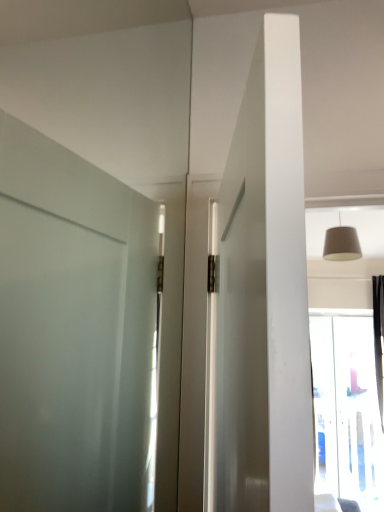
Question: Are transparent glass window at upper right and matte beige lampshade at upper right making contact?

Choices:
 (A) yes
 (B) no

Answer: (B)

Question: From a real-world perspective, is transparent glass window at upper right beneath matte beige lampshade at upper right?

Choices:
 (A) no
 (B) yes

Answer: (B)

Question: Considering the relative positions of transparent glass window at upper right and matte beige lampshade at upper right in the image provided, is transparent glass window at upper right to the right of matte beige lampshade at upper right from the viewer's perspective?

Choices:
 (A) yes
 (B) no

Answer: (A)

Question: Is transparent glass window at upper right bigger than matte beige lampshade at upper right?

Choices:
 (A) no
 (B) yes

Answer: (B)

Question: Does transparent glass window at upper right have a lesser width compared to matte beige lampshade at upper right?

Choices:
 (A) yes
 (B) no

Answer: (A)

Question: Can you confirm if transparent glass window at upper right is shorter than matte beige lampshade at upper right?

Choices:
 (A) yes
 (B) no

Answer: (B)

Question: Is matte beige lampshade at upper right further to camera compared to transparent glass window at upper right?

Choices:
 (A) yes
 (B) no

Answer: (B)

Question: Is matte beige lampshade at upper right taller than transparent glass window at upper right?

Choices:
 (A) yes
 (B) no

Answer: (B)

Question: Is the position of matte beige lampshade at upper right less distant than that of transparent glass window at upper right?

Choices:
 (A) yes
 (B) no

Answer: (A)

Question: From the image's perspective, is matte beige lampshade at upper right beneath transparent glass window at upper right?

Choices:
 (A) no
 (B) yes

Answer: (A)

Question: From the image's perspective, is matte beige lampshade at upper right on top of transparent glass window at upper right?

Choices:
 (A) no
 (B) yes

Answer: (B)

Question: Considering the relative positions of matte beige lampshade at upper right and transparent glass window at upper right in the image provided, is matte beige lampshade at upper right to the left of transparent glass window at upper right from the viewer's perspective?

Choices:
 (A) yes
 (B) no

Answer: (A)

Question: From their relative heights in the image, would you say transparent glass window at upper right is taller or shorter than matte beige lampshade at upper right?

Choices:
 (A) tall
 (B) short

Answer: (A)